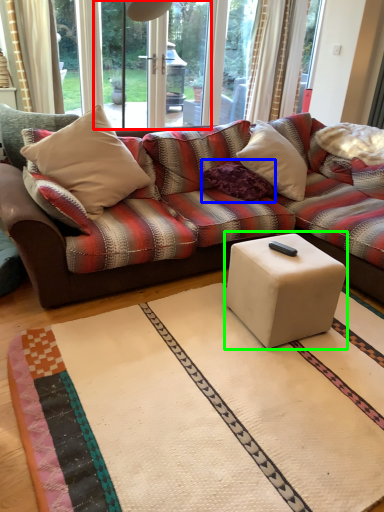
Question: Considering the real-world distances, which object is farthest from screen door (highlighted by a red box)? pillow (highlighted by a blue box) or coffee table (highlighted by a green box)?

Choices:
 (A) pillow
 (B) coffee table

Answer: (B)